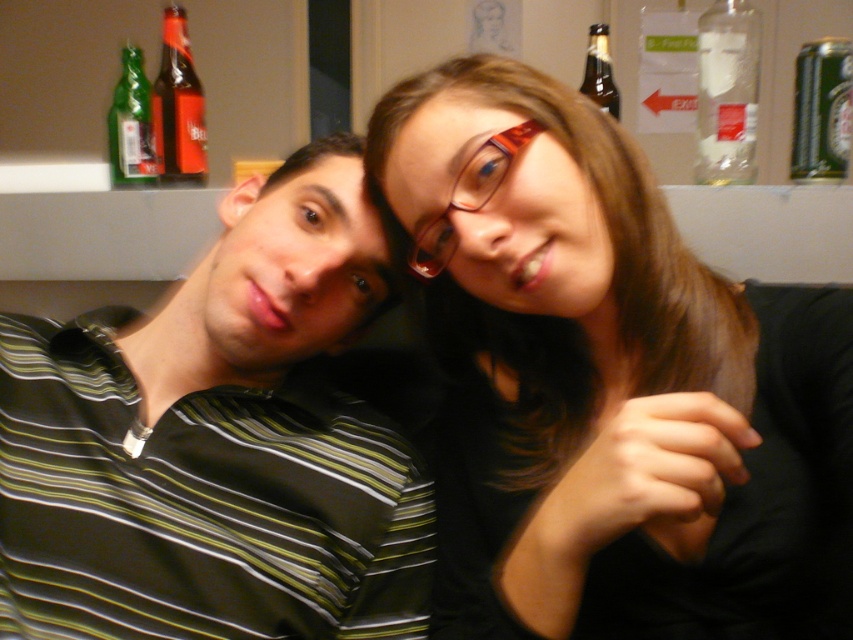
Is striped cotton shirt at left below brown glass bottle at upper right?

Indeed, striped cotton shirt at left is positioned under brown glass bottle at upper right.

Who is more forward, (286, 515) or (601, 90)?

Point (286, 515) is more forward.

The width and height of the screenshot is (853, 640). I want to click on striped cotton shirt at left, so click(x=215, y=444).

Who is more distant from viewer, (822, 132) or (442, 268)?

Positioned behind is point (822, 132).

Can you confirm if green metallic can at upper right is taller than translucent red glasses at center?

Yes, green metallic can at upper right is taller than translucent red glasses at center.

This screenshot has height=640, width=853. Identify the location of green metallic can at upper right. (821, 112).

The width and height of the screenshot is (853, 640). Describe the element at coordinates (611, 381) in the screenshot. I see `matte black hair at upper right` at that location.

Which is behind, point (558, 634) or point (722, 148)?

The point (722, 148) is more distant.

Which is behind, point (709, 493) or point (712, 134)?

Point (712, 134)

Find the location of `matte black hair at upper right`. matte black hair at upper right is located at coordinates (611, 381).